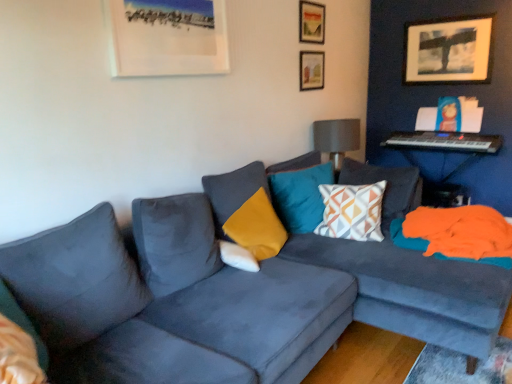
Question: In which direction should I rotate to look at wooden picture frame at upper center, marked as the second picture frame in a right-to-left arrangement?

Choices:
 (A) left
 (B) right

Answer: (B)

Question: From the image's perspective, would you say teal velvet pillow at center, which is the 3th pillow from left to right, is shown under wooden picture frame at upper center, which ranks as the 3th picture frame in back-to-front order?

Choices:
 (A) yes
 (B) no

Answer: (A)

Question: Is teal velvet pillow at center, which is the 3th pillow from left to right, positioned beyond the bounds of wooden picture frame at upper center, the 2th picture frame from the left?

Choices:
 (A) no
 (B) yes

Answer: (B)

Question: Would you say teal velvet pillow at center, the 2th pillow in the right-to-left sequence, is a long distance from wooden picture frame at upper center, the third picture frame viewed from the right?

Choices:
 (A) no
 (B) yes

Answer: (B)

Question: Considering the relative positions of teal velvet pillow at center, the 2th pillow in the right-to-left sequence, and wooden picture frame at upper center, the 2th picture frame in the front-to-back sequence, in the image provided, is teal velvet pillow at center, the 2th pillow in the right-to-left sequence, to the left of wooden picture frame at upper center, the 2th picture frame in the front-to-back sequence, from the viewer's perspective?

Choices:
 (A) yes
 (B) no

Answer: (A)

Question: Can you confirm if teal velvet pillow at center, which is the 3th pillow from left to right, is taller than wooden picture frame at upper center, the third picture frame viewed from the right?

Choices:
 (A) no
 (B) yes

Answer: (B)

Question: Can you confirm if teal velvet pillow at center, the 2th pillow in the right-to-left sequence, is shorter than wooden picture frame at upper center, the third picture frame viewed from the right?

Choices:
 (A) no
 (B) yes

Answer: (A)

Question: Does matte gray lampshade at upper right come in front of teal velvet pillow at center, which is the 3th pillow from left to right?

Choices:
 (A) no
 (B) yes

Answer: (A)

Question: Could you tell me if matte gray lampshade at upper right is facing teal velvet pillow at center, the 2th pillow in the right-to-left sequence?

Choices:
 (A) yes
 (B) no

Answer: (B)

Question: Is matte gray lampshade at upper right smaller than teal velvet pillow at center, the 2th pillow in the right-to-left sequence?

Choices:
 (A) no
 (B) yes

Answer: (A)

Question: Is matte gray lampshade at upper right far from teal velvet pillow at center, which is the 3th pillow from left to right?

Choices:
 (A) no
 (B) yes

Answer: (A)

Question: Can you confirm if matte gray lampshade at upper right is positioned to the right of teal velvet pillow at center, the 2th pillow in the right-to-left sequence?

Choices:
 (A) yes
 (B) no

Answer: (A)

Question: Does matte gray lampshade at upper right touch teal velvet pillow at center, which is the 3th pillow from left to right?

Choices:
 (A) no
 (B) yes

Answer: (A)

Question: Does white soft pillow at center, which is the 4th pillow in right-to-left order, have a greater height compared to wooden picture frame at upper right, the first picture frame when ordered from back to front?

Choices:
 (A) no
 (B) yes

Answer: (A)